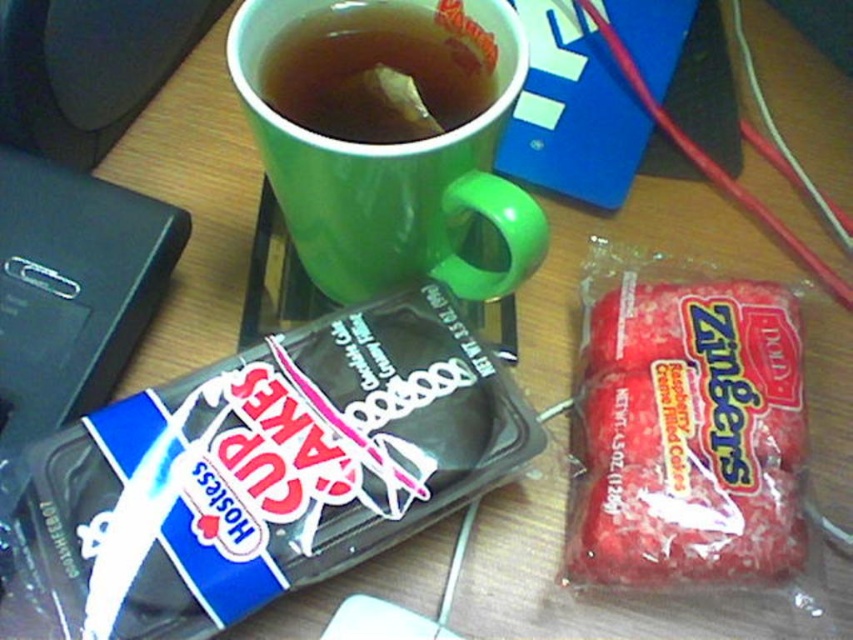
Question: Is red matte candy at right below green matte cup at upper center?

Choices:
 (A) no
 (B) yes

Answer: (B)

Question: Which point is closer to the camera?

Choices:
 (A) (460, 116)
 (B) (434, 324)

Answer: (A)

Question: Where is red matte candy at right located in relation to green matte cup at upper center in the image?

Choices:
 (A) right
 (B) left

Answer: (A)

Question: Which object is the closest to the blue plastic cupcake at lower left?

Choices:
 (A) green matte cup at upper center
 (B) green matte mug at upper center

Answer: (B)

Question: Considering the relative positions of blue plastic cupcake at lower left and red matte candy at right in the image provided, where is blue plastic cupcake at lower left located with respect to red matte candy at right?

Choices:
 (A) left
 (B) right

Answer: (A)

Question: Among these objects, which one is farthest from the camera?

Choices:
 (A) green matte mug at upper center
 (B) green matte cup at upper center
 (C) red matte candy at right
 (D) blue plastic cupcake at lower left

Answer: (B)